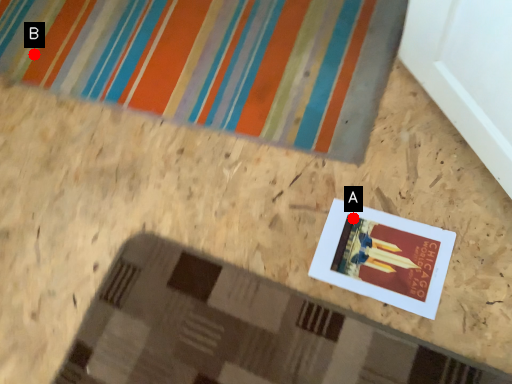
Question: Two points are circled on the image, labeled by A and B beside each circle. Among these points, which one is farthest from the camera?

Choices:
 (A) A is further
 (B) B is further

Answer: (B)